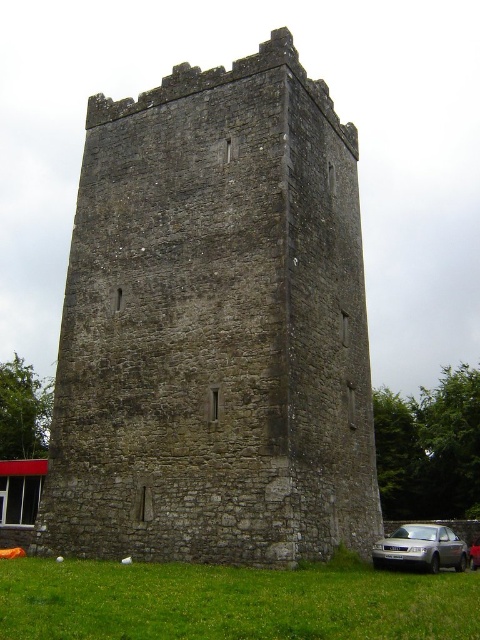
Question: Which point is closer to the camera?

Choices:
 (A) (106, 637)
 (B) (478, 548)
 (C) (435, 554)

Answer: (A)

Question: Which point is closer to the camera?

Choices:
 (A) (470, 566)
 (B) (10, 602)

Answer: (B)

Question: Where is green grass at lower center located in relation to satin silver car at lower right in the image?

Choices:
 (A) above
 (B) below

Answer: (A)

Question: Is gray stone tower at center to the right of satin silver car at lower right from the viewer's perspective?

Choices:
 (A) yes
 (B) no

Answer: (B)

Question: Does green grass at lower center have a lesser width compared to satin silver car at lower right?

Choices:
 (A) no
 (B) yes

Answer: (A)

Question: Which object is farther from the camera taking this photo?

Choices:
 (A) green grass at lower center
 (B) satin silver car at lower right
 (C) gray stone tower at center

Answer: (B)